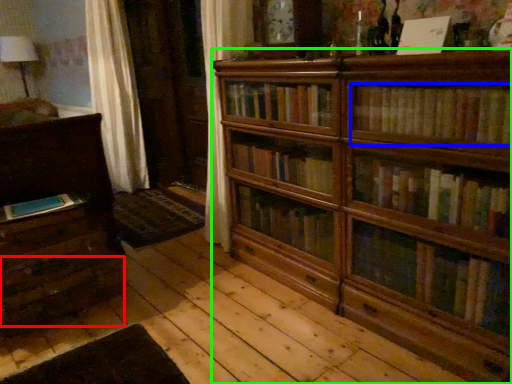
Question: Considering the real-world distances, which object is closest to drawer (highlighted by a red box)? book (highlighted by a blue box) or bookcase (highlighted by a green box).

Choices:
 (A) book
 (B) bookcase

Answer: (B)